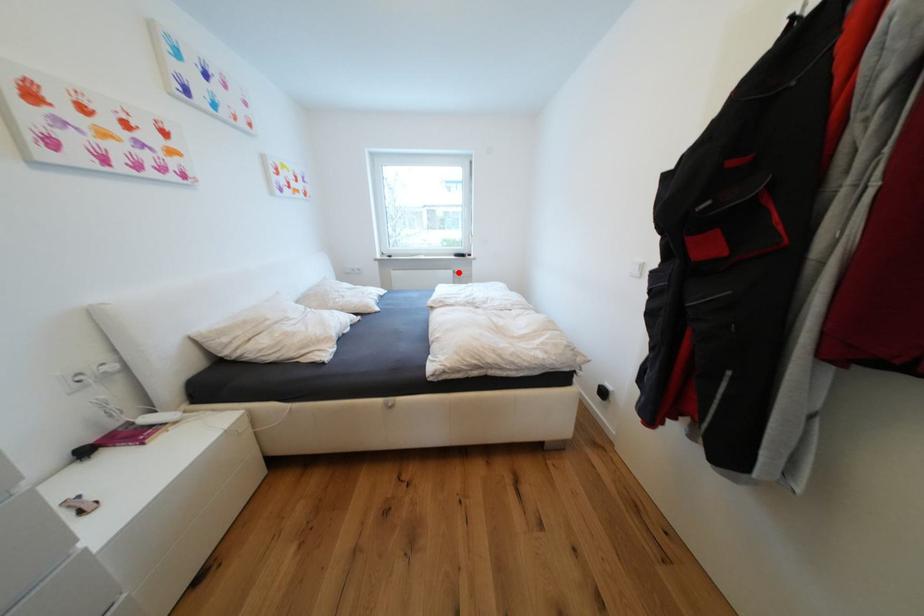
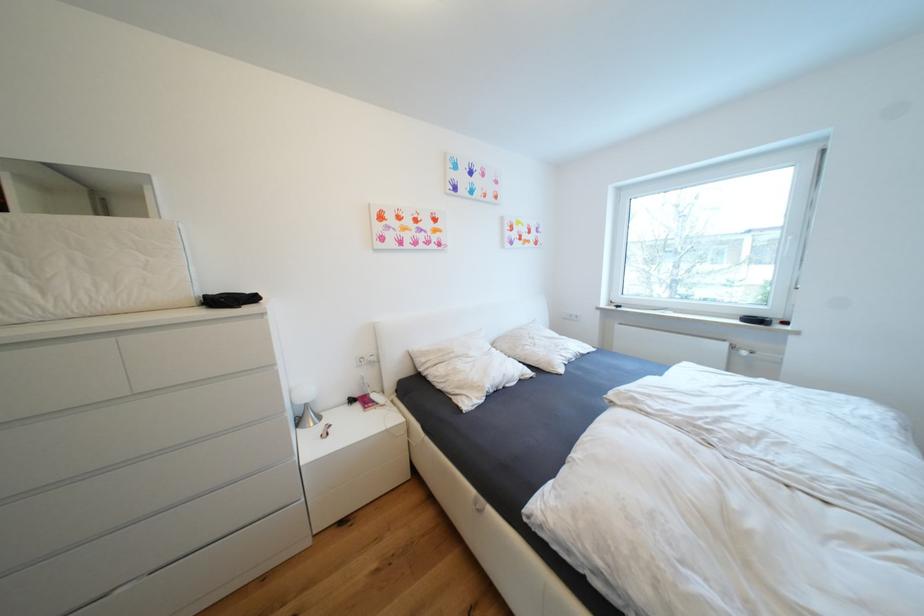
Locate, in the second image, the point that corresponds to the highlighted location in the first image.

(733, 346)